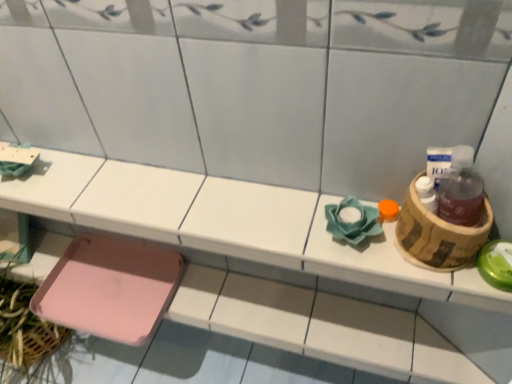
Question: From the image's perspective, is pink plastic step stool at lower left located above pink plastic tray at lower left?

Choices:
 (A) yes
 (B) no

Answer: (B)

Question: Is pink plastic step stool at lower left positioned before pink plastic tray at lower left?

Choices:
 (A) yes
 (B) no

Answer: (B)

Question: Is pink plastic step stool at lower left facing towards pink plastic tray at lower left?

Choices:
 (A) no
 (B) yes

Answer: (A)

Question: Can you confirm if pink plastic step stool at lower left is thinner than pink plastic tray at lower left?

Choices:
 (A) yes
 (B) no

Answer: (B)

Question: Is pink plastic step stool at lower left not within pink plastic tray at lower left?

Choices:
 (A) no
 (B) yes

Answer: (B)

Question: Does pink plastic step stool at lower left have a lesser height compared to pink plastic tray at lower left?

Choices:
 (A) yes
 (B) no

Answer: (A)

Question: Considering the relative positions of pink plastic step stool at lower left and brown cardboard basket at right in the image provided, is pink plastic step stool at lower left behind brown cardboard basket at right?

Choices:
 (A) yes
 (B) no

Answer: (A)

Question: Does pink plastic step stool at lower left have a lesser height compared to brown cardboard basket at right?

Choices:
 (A) yes
 (B) no

Answer: (A)

Question: From a real-world perspective, is pink plastic step stool at lower left on top of brown cardboard basket at right?

Choices:
 (A) yes
 (B) no

Answer: (B)

Question: Can you see pink plastic step stool at lower left touching brown cardboard basket at right?

Choices:
 (A) yes
 (B) no

Answer: (B)

Question: Can we say pink plastic step stool at lower left lies outside brown cardboard basket at right?

Choices:
 (A) no
 (B) yes

Answer: (B)

Question: Are pink plastic step stool at lower left and brown cardboard basket at right far apart?

Choices:
 (A) yes
 (B) no

Answer: (B)

Question: Is brown cardboard basket at right a part of pink plastic tray at lower left?

Choices:
 (A) yes
 (B) no

Answer: (B)